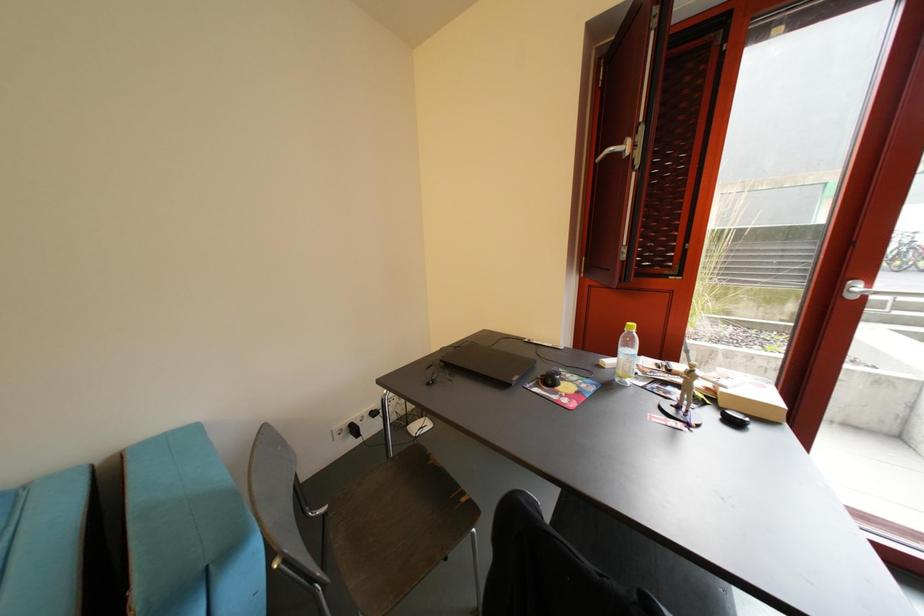
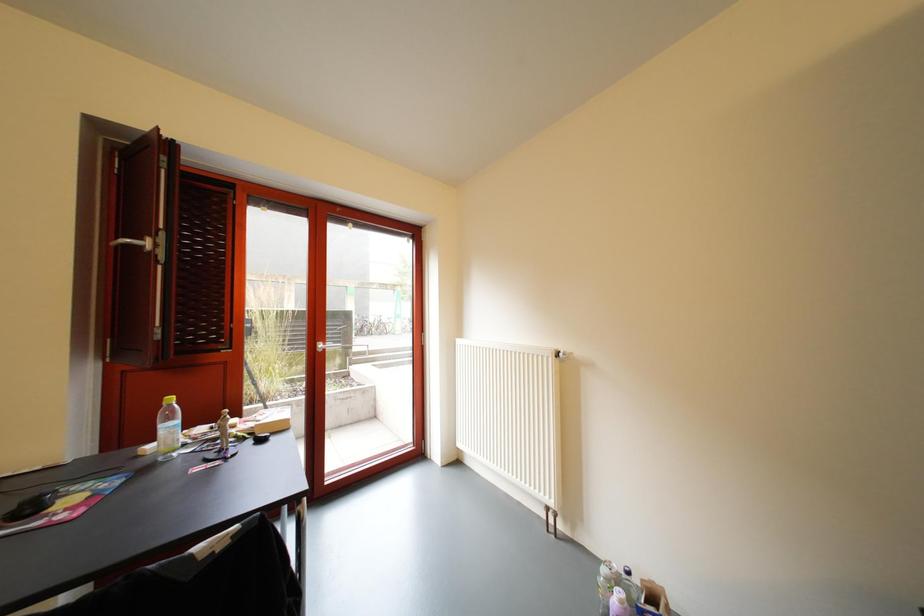
Question: The camera is either moving clockwise (left) or counter-clockwise (right) around the object. The first image is from the beginning of the video and the second image is from the end. Is the camera moving left or right when shooting the video?

Choices:
 (A) Left
 (B) Right

Answer: (A)